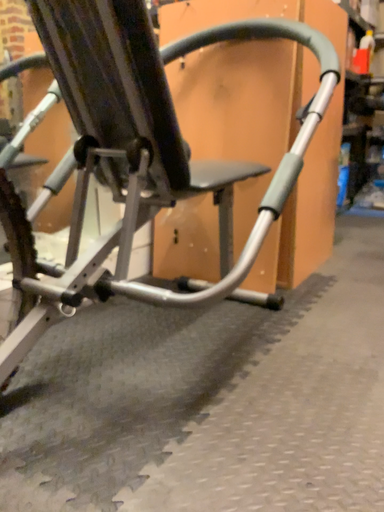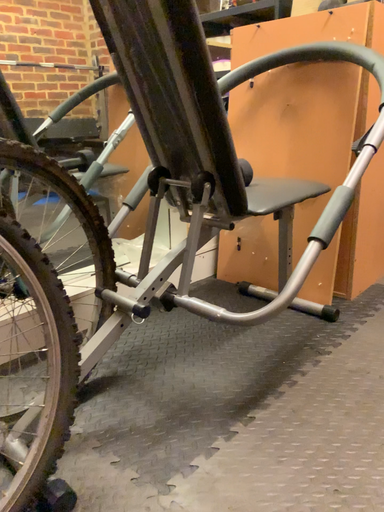
Question: Which way did the camera rotate in the video?

Choices:
 (A) rotated left
 (B) rotated right

Answer: (A)